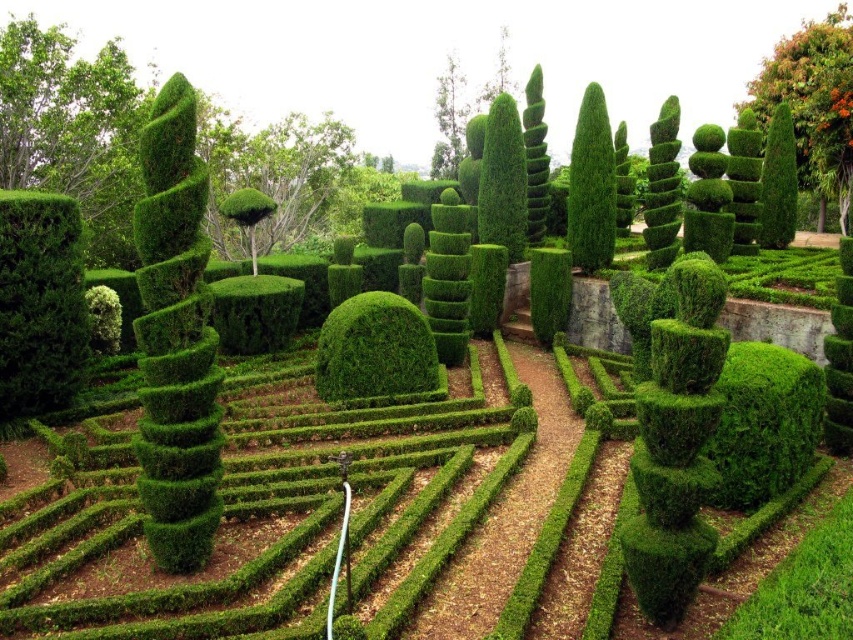
Is green leafy bush at upper right behind green textured bush at center?

Yes, it is.

Describe the element at coordinates (813, 100) in the screenshot. I see `green leafy bush at upper right` at that location.

Identify the location of green leafy bush at upper right. (813, 100).

Which is above, green textured bush at center or green leafy tree at upper center?

green leafy tree at upper center is above.

Can you confirm if green textured bush at center is thinner than green leafy tree at upper center?

Indeed, green textured bush at center has a lesser width compared to green leafy tree at upper center.

The width and height of the screenshot is (853, 640). In order to click on green textured bush at center in this screenshot , I will do `click(549, 292)`.

Locate an element on the screen. The width and height of the screenshot is (853, 640). green leafy bush at center is located at coordinates (274, 176).